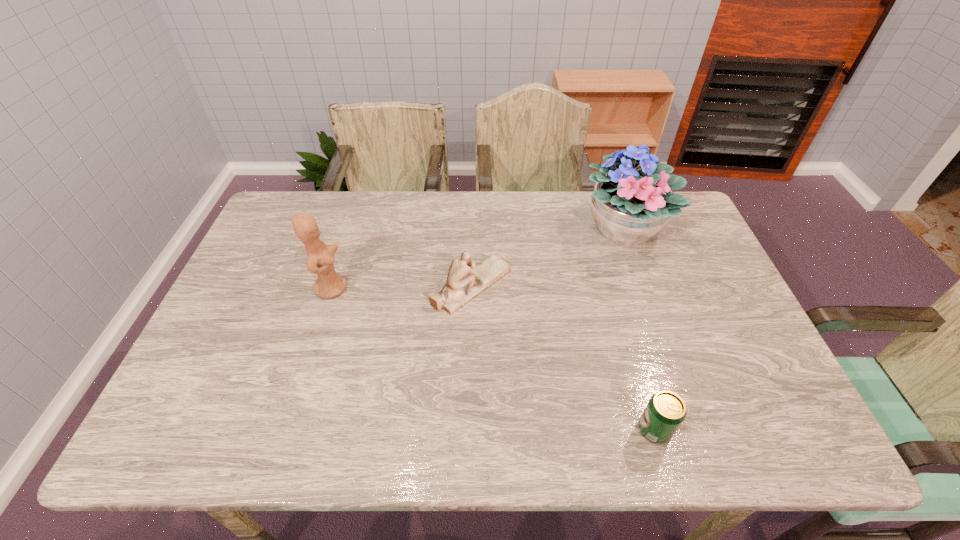
Identify the location of free region located on the left of the shortest object. (527, 429).

This screenshot has width=960, height=540. What are the coordinates of `object present at the far edge` in the screenshot? It's located at (630, 206).

Identify the location of object positioned at the near edge. This screenshot has height=540, width=960. (665, 412).

The image size is (960, 540). Identify the location of object positioned at the right edge. (630, 206).

Where is `object present at the far right corner`? This screenshot has height=540, width=960. object present at the far right corner is located at coordinates (630, 206).

Identify the location of vacant space at the far edge of the desktop. Image resolution: width=960 pixels, height=540 pixels. (507, 220).

The width and height of the screenshot is (960, 540). I want to click on blank area at the near edge, so click(x=458, y=416).

What are the coordinates of `free space at the left edge of the desktop` in the screenshot? It's located at (278, 310).

Where is `vacant space at the right edge of the desktop`? The width and height of the screenshot is (960, 540). vacant space at the right edge of the desktop is located at coordinates (730, 306).

This screenshot has width=960, height=540. Find the location of `vacant space at the far left corner of the desktop`. vacant space at the far left corner of the desktop is located at coordinates (282, 209).